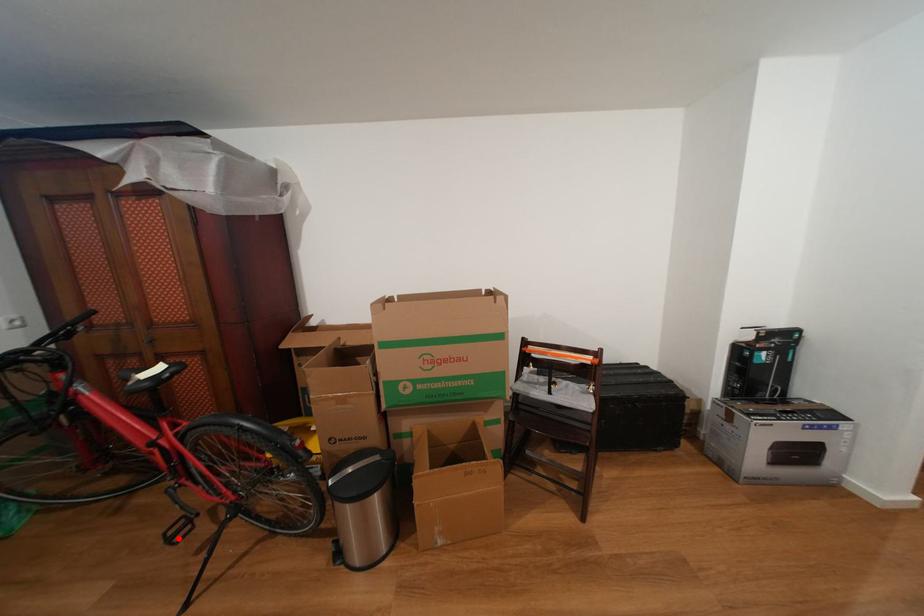
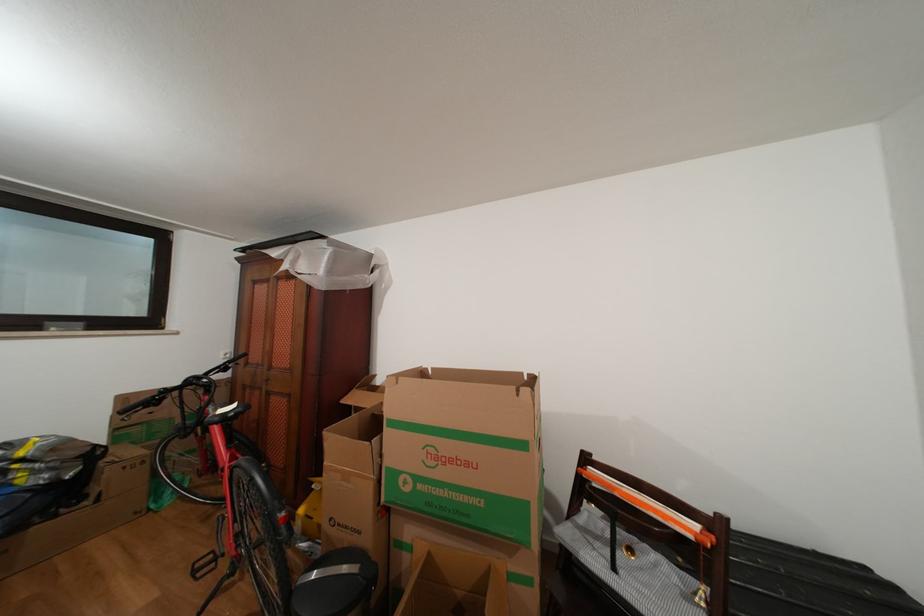
In the second image, find the point that corresponds to the highlighted location in the first image.

(205, 570)